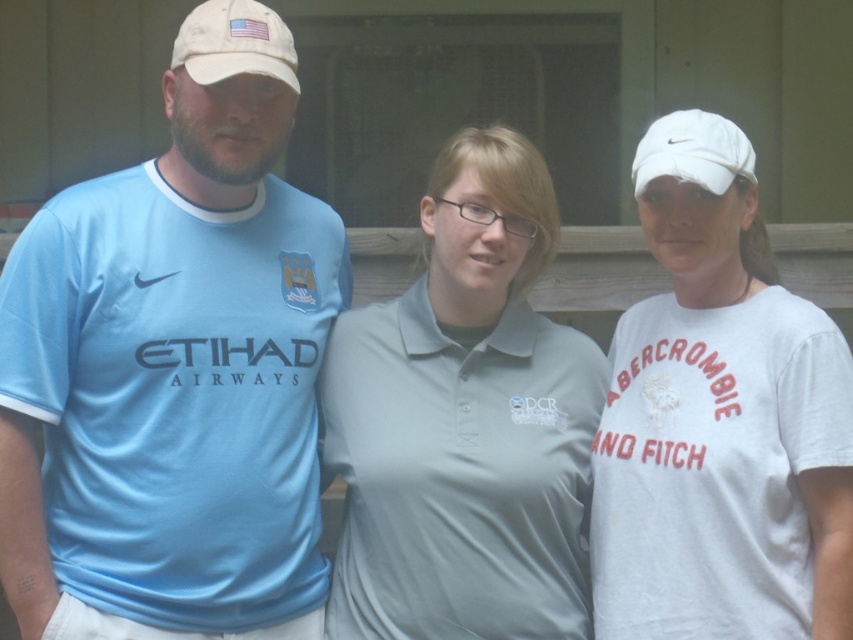
Question: Can you confirm if light blue jersey at left is positioned above white fabric baseball cap at upper left?

Choices:
 (A) yes
 (B) no

Answer: (B)

Question: Among these objects, which one is nearest to the camera?

Choices:
 (A) white cotton t-shirt at right
 (B) light blue jersey at left

Answer: (A)

Question: Estimate the real-world distances between objects in this image. Which object is closer to the light blue jersey at left?

Choices:
 (A) gray cotton polo shirt at center
 (B) white fabric baseball cap at upper right

Answer: (A)

Question: Based on their relative distances, which object is farther from the light blue jersey at left?

Choices:
 (A) gray cotton polo shirt at center
 (B) white fabric baseball cap at upper left
 (C) white fabric baseball cap at upper right
 (D) white cotton t-shirt at right

Answer: (C)

Question: Where is light blue jersey at left located in relation to white cotton t-shirt at right in the image?

Choices:
 (A) left
 (B) right

Answer: (A)

Question: Is light blue jersey at left closer to the viewer compared to white fabric baseball cap at upper left?

Choices:
 (A) no
 (B) yes

Answer: (B)